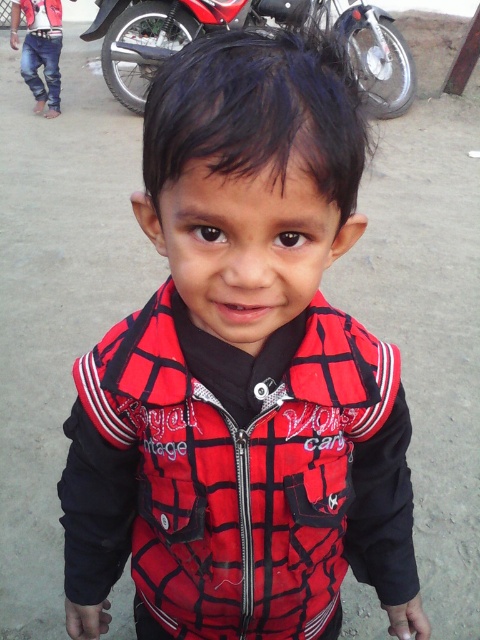
Between metallic red motorcycle at upper center and jeans at left, which one appears on the right side from the viewer's perspective?

metallic red motorcycle at upper center is more to the right.

Locate an element on the screen. This screenshot has height=640, width=480. metallic red motorcycle at upper center is located at coordinates (243, 26).

In the scene shown: Which is more to the right, jeans at left or matte red vest at upper left?

From the viewer's perspective, matte red vest at upper left appears more on the right side.

Between jeans at left and matte red vest at upper left, which one appears on the left side from the viewer's perspective?

jeans at left is more to the left.

Identify the location of jeans at left. This screenshot has width=480, height=640. (39, 49).

Between point (298, 20) and point (21, 3), which one is positioned in front?

Point (21, 3) is in front.

Between point (146, 54) and point (37, 8), which one is positioned behind?

The point (37, 8) is behind.

Where is `metallic red motorcycle at upper center`? metallic red motorcycle at upper center is located at coordinates (243, 26).